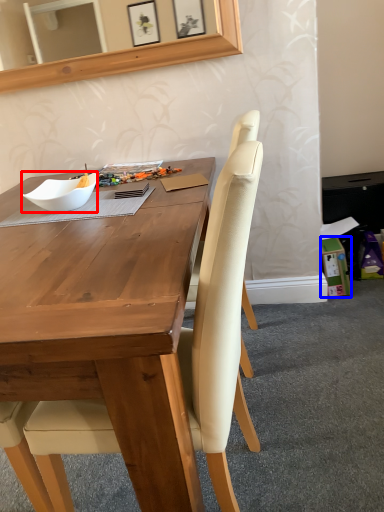
Question: Which object appears closest to the camera in this image, bowl (highlighted by a red box) or box (highlighted by a blue box)?

Choices:
 (A) bowl
 (B) box

Answer: (A)